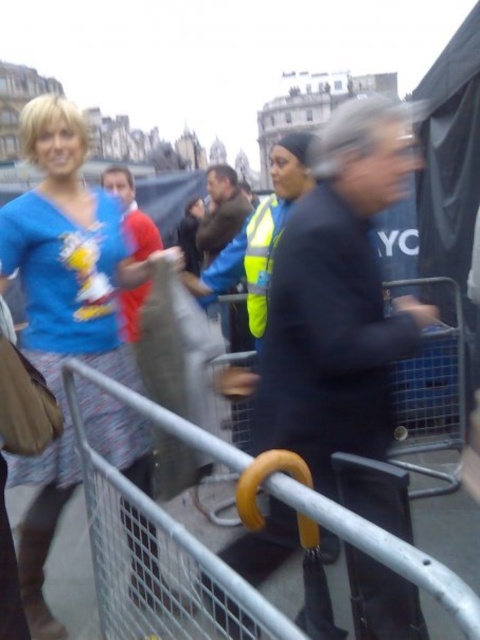
Is point (372, 593) positioned in front of point (140, 244)?

Yes.

Does black matte jacket at center appear over red shirt at center?

Correct, black matte jacket at center is located above red shirt at center.

Find the location of `black matte jacket at center`. black matte jacket at center is located at coordinates (338, 298).

Does brown leather jacket at center have a lesser width compared to red shirt at center?

Indeed, brown leather jacket at center has a lesser width compared to red shirt at center.

Does brown leather jacket at center appear under red shirt at center?

Incorrect, brown leather jacket at center is not positioned below red shirt at center.

Between point (244, 214) and point (147, 253), which one is positioned in front?

Positioned in front is point (147, 253).

The width and height of the screenshot is (480, 640). Identify the location of brown leather jacket at center. (220, 212).

Is black matte jacket at center bigger than brown leather jacket at center?

Indeed, black matte jacket at center has a larger size compared to brown leather jacket at center.

Where is `black matte jacket at center`? The width and height of the screenshot is (480, 640). black matte jacket at center is located at coordinates (338, 298).